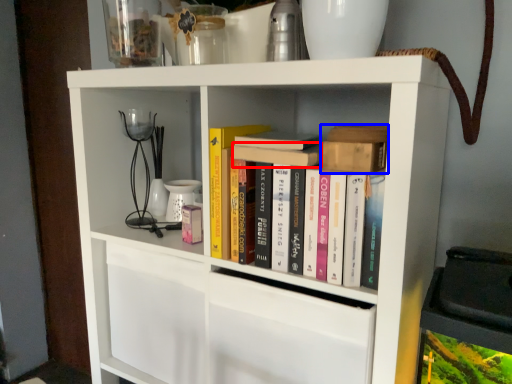
Question: Which object appears closest to the camera in this image, book (highlighted by a red box) or book (highlighted by a blue box)?

Choices:
 (A) book
 (B) book

Answer: (B)